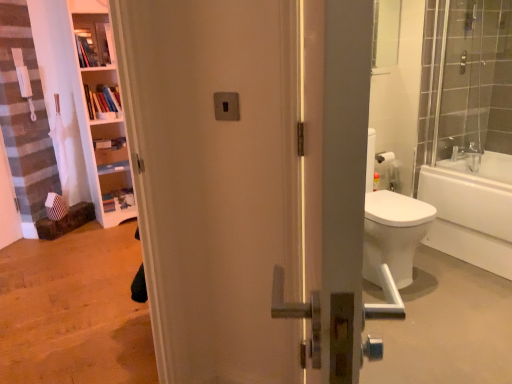
Image resolution: width=512 pixels, height=384 pixels. Identify the location of wooden shelves at upper left, positioned as the first shelf in top-to-bottom order. (92, 39).

What are the coordinates of `wooden bookshelf at upper left, the first shelf from the bottom` in the screenshot? It's located at (101, 96).

I want to click on clear glass shower door at right, so pyautogui.click(x=475, y=80).

How different are the orientations of wooden bookshelf at upper left, the first shelf from the bottom, and clear glass shower door at right in degrees?

They differ by 97.8 degrees in their facing directions.

Considering the relative sizes of wooden bookshelf at upper left, placed as the second shelf when sorted from top to bottom, and clear glass shower door at right in the image provided, is wooden bookshelf at upper left, placed as the second shelf when sorted from top to bottom, smaller than clear glass shower door at right?

Correct, wooden bookshelf at upper left, placed as the second shelf when sorted from top to bottom, occupies less space than clear glass shower door at right.

From the picture: Is wooden bookshelf at upper left, placed as the second shelf when sorted from top to bottom, with clear glass shower door at right?

No, wooden bookshelf at upper left, placed as the second shelf when sorted from top to bottom, is not touching clear glass shower door at right.

Based on the photo, from a real-world perspective, does wooden bookshelf at upper left, the first shelf from the bottom, sit lower than clear glass shower door at right?

Correct, in the physical world, wooden bookshelf at upper left, the first shelf from the bottom, is lower than clear glass shower door at right.

Is wooden bookshelf at upper left, placed as the second shelf when sorted from top to bottom, completely or partially inside clear glass shower door at right?

Actually, wooden bookshelf at upper left, placed as the second shelf when sorted from top to bottom, is outside clear glass shower door at right.

In the scene shown: From a real-world perspective, is clear glass shower door at right on wooden bookshelf at upper left, placed as the second shelf when sorted from top to bottom?

Yes, from a real-world perspective, clear glass shower door at right is over wooden bookshelf at upper left, placed as the second shelf when sorted from top to bottom

Is point (498, 112) farther from viewer compared to point (106, 106)?

That is False.

Consider the image. Which of these two, clear glass shower door at right or wooden bookshelf at upper left, the first shelf from the bottom, is wider?

wooden bookshelf at upper left, the first shelf from the bottom.

Is white glossy bathtub at right positioned with its back to wooden bookshelf at upper left, placed as the second shelf when sorted from top to bottom?

No.

Is point (498, 240) farther from viewer compared to point (115, 117)?

No.

Does white glossy bathtub at right have a smaller size compared to wooden bookshelf at upper left, the first shelf from the bottom?

Actually, white glossy bathtub at right might be larger than wooden bookshelf at upper left, the first shelf from the bottom.

In terms of height, does white glossy bathtub at right look taller or shorter compared to wooden bookshelf at upper left, the first shelf from the bottom?

Clearly, white glossy bathtub at right is taller compared to wooden bookshelf at upper left, the first shelf from the bottom.

From the picture: Between white glossy bathtub at right and wooden shelves at upper left, positioned as the first shelf in top-to-bottom order, which one has less height?

With less height is wooden shelves at upper left, positioned as the first shelf in top-to-bottom order.

How distant is white glossy bathtub at right from wooden shelves at upper left, positioned as the first shelf in top-to-bottom order?

The distance of white glossy bathtub at right from wooden shelves at upper left, positioned as the first shelf in top-to-bottom order, is 2.73 meters.

Does white glossy bathtub at right have a larger size compared to wooden shelves at upper left, positioned as the second shelf in bottom-to-top order?

Indeed, white glossy bathtub at right has a larger size compared to wooden shelves at upper left, positioned as the second shelf in bottom-to-top order.

Considering the positions of objects white glossy bathtub at right and wooden shelves at upper left, positioned as the first shelf in top-to-bottom order, in the image provided, who is more to the right, white glossy bathtub at right or wooden shelves at upper left, positioned as the first shelf in top-to-bottom order,?

white glossy bathtub at right is more to the right.

Is wooden bookshelf at upper left, placed as the second shelf when sorted from top to bottom, taller than wooden shelves at upper left, positioned as the second shelf in bottom-to-top order?

No.

The image size is (512, 384). Identify the location of shelf directly beneath the wooden shelves at upper left, positioned as the first shelf in top-to-bottom order (from a real-world perspective). (101, 96).

Measure the distance from wooden bookshelf at upper left, the first shelf from the bottom, to wooden shelves at upper left, positioned as the first shelf in top-to-bottom order.

They are 9.70 inches apart.

Which is behind, point (93, 81) or point (104, 39)?

The point (93, 81) is farther from the camera.

Is wooden shelves at upper left, positioned as the first shelf in top-to-bottom order, next to wooden bookshelf at upper left, the first shelf from the bottom, and touching it?

No, wooden shelves at upper left, positioned as the first shelf in top-to-bottom order, is not beside wooden bookshelf at upper left, the first shelf from the bottom.

Find the location of a particular element. This screenshot has height=384, width=512. shelf behind the wooden shelves at upper left, positioned as the first shelf in top-to-bottom order is located at coordinates (101, 96).

From the image's perspective, is wooden shelves at upper left, positioned as the second shelf in bottom-to-top order, beneath wooden bookshelf at upper left, placed as the second shelf when sorted from top to bottom?

Actually, wooden shelves at upper left, positioned as the second shelf in bottom-to-top order, appears above wooden bookshelf at upper left, placed as the second shelf when sorted from top to bottom, in the image.

Between wooden shelves at upper left, positioned as the second shelf in bottom-to-top order, and wooden bookshelf at upper left, the first shelf from the bottom, which one has smaller size?

With smaller size is wooden shelves at upper left, positioned as the second shelf in bottom-to-top order.

Is clear glass shower door at right next to wooden shelves at upper left, positioned as the first shelf in top-to-bottom order?

No.

Is clear glass shower door at right inside the boundaries of wooden shelves at upper left, positioned as the second shelf in bottom-to-top order, or outside?

clear glass shower door at right is not inside wooden shelves at upper left, positioned as the second shelf in bottom-to-top order, it's outside.

Considering the relative sizes of clear glass shower door at right and wooden shelves at upper left, positioned as the first shelf in top-to-bottom order, in the image provided, is clear glass shower door at right taller than wooden shelves at upper left, positioned as the first shelf in top-to-bottom order,?

Yes.

Where is `shelf that is the 2nd one when counting backward from the clear glass shower door at right`? The height and width of the screenshot is (384, 512). shelf that is the 2nd one when counting backward from the clear glass shower door at right is located at coordinates (101, 96).

In order to click on shelf below the clear glass shower door at right (from a real-world perspective) in this screenshot , I will do `click(101, 96)`.

Looking at the image, which one is located further to white glossy bathtub at right, clear glass shower door at right or wooden bookshelf at upper left, the first shelf from the bottom?

wooden bookshelf at upper left, the first shelf from the bottom, lies further to white glossy bathtub at right than the other object.

When comparing their distances from wooden shelves at upper left, positioned as the second shelf in bottom-to-top order, does white glossy bathtub at right or wooden bookshelf at upper left, the first shelf from the bottom, seem closer?

The object closer to wooden shelves at upper left, positioned as the second shelf in bottom-to-top order, is wooden bookshelf at upper left, the first shelf from the bottom.

Which object lies further to the anchor point wooden bookshelf at upper left, the first shelf from the bottom, clear glass shower door at right or wooden shelves at upper left, positioned as the first shelf in top-to-bottom order?

Based on the image, clear glass shower door at right appears to be further to wooden bookshelf at upper left, the first shelf from the bottom.

From the image, which object appears to be nearer to wooden bookshelf at upper left, the first shelf from the bottom, white glossy bathtub at right or clear glass shower door at right?

white glossy bathtub at right lies closer to wooden bookshelf at upper left, the first shelf from the bottom, than the other object.

Based on their spatial positions, is clear glass shower door at right or wooden bookshelf at upper left, placed as the second shelf when sorted from top to bottom, further from wooden shelves at upper left, positioned as the first shelf in top-to-bottom order?

clear glass shower door at right lies further to wooden shelves at upper left, positioned as the first shelf in top-to-bottom order, than the other object.

Which object lies nearer to the anchor point wooden shelves at upper left, positioned as the second shelf in bottom-to-top order, clear glass shower door at right or white glossy bathtub at right?

Among the two, clear glass shower door at right is located nearer to wooden shelves at upper left, positioned as the second shelf in bottom-to-top order.

Looking at the image, which one is located closer to wooden shelves at upper left, positioned as the second shelf in bottom-to-top order, wooden bookshelf at upper left, the first shelf from the bottom, or clear glass shower door at right?

The object closer to wooden shelves at upper left, positioned as the second shelf in bottom-to-top order, is wooden bookshelf at upper left, the first shelf from the bottom.

When comparing their distances from clear glass shower door at right, does white glossy bathtub at right or wooden bookshelf at upper left, placed as the second shelf when sorted from top to bottom, seem further?

wooden bookshelf at upper left, placed as the second shelf when sorted from top to bottom, is positioned further to the anchor clear glass shower door at right.

Locate an element on the screen. shelf situated between wooden shelves at upper left, positioned as the second shelf in bottom-to-top order, and clear glass shower door at right from left to right is located at coordinates (101, 96).

At what (x,y) coordinates should I click in order to perform the action: click on shelf between wooden shelves at upper left, positioned as the first shelf in top-to-bottom order, and white glossy bathtub at right from left to right. Please return your answer as a coordinate pair (x, y). Looking at the image, I should click on (101, 96).

Find the location of a particular element. Image resolution: width=512 pixels, height=384 pixels. shower door situated between wooden shelves at upper left, positioned as the second shelf in bottom-to-top order, and white glossy bathtub at right from left to right is located at coordinates (475, 80).

Identify the location of shower door between wooden bookshelf at upper left, placed as the second shelf when sorted from top to bottom, and white glossy bathtub at right. The width and height of the screenshot is (512, 384). pyautogui.click(x=475, y=80).